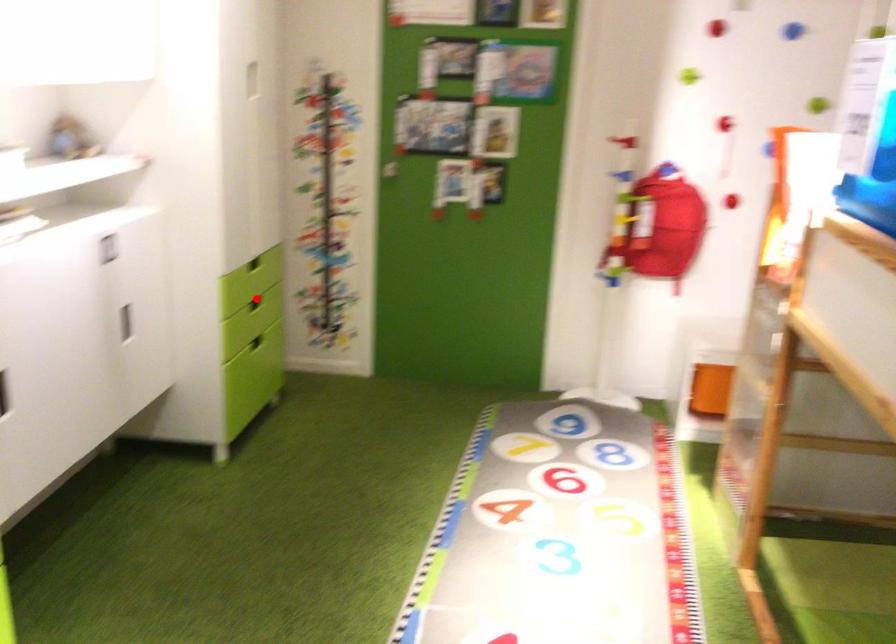
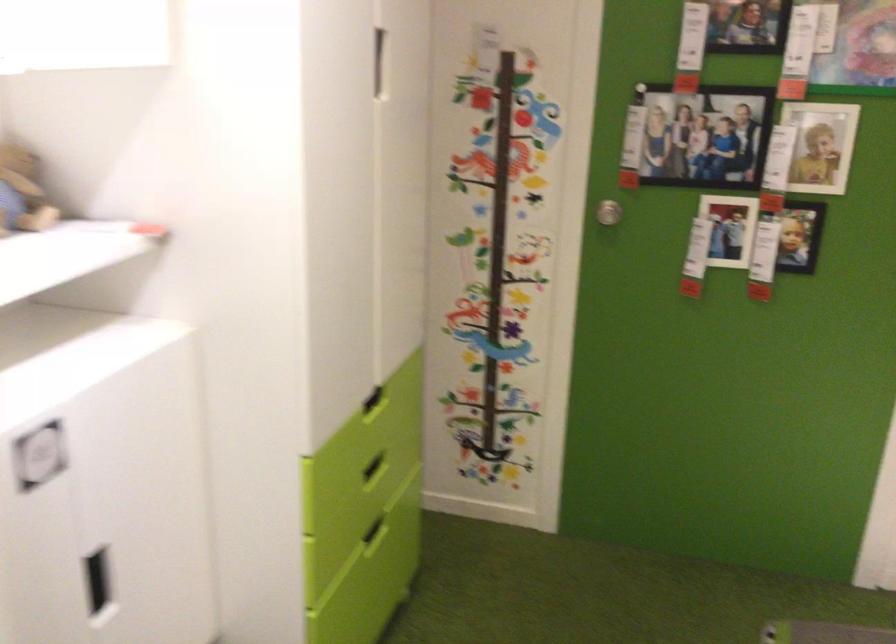
Locate, in the second image, the point that corresponds to the highlighted location in the first image.

(374, 468)